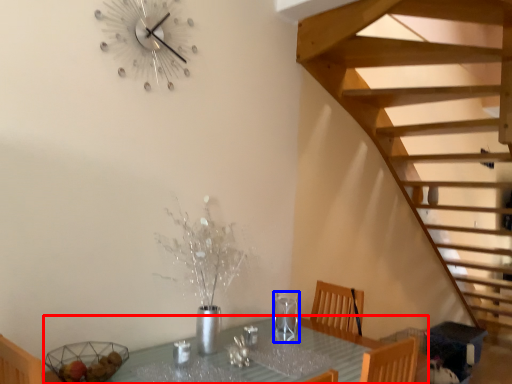
Question: Which object appears closest to the camera in this image, table (highlighted by a red box) or wine glass (highlighted by a blue box)?

Choices:
 (A) table
 (B) wine glass

Answer: (A)